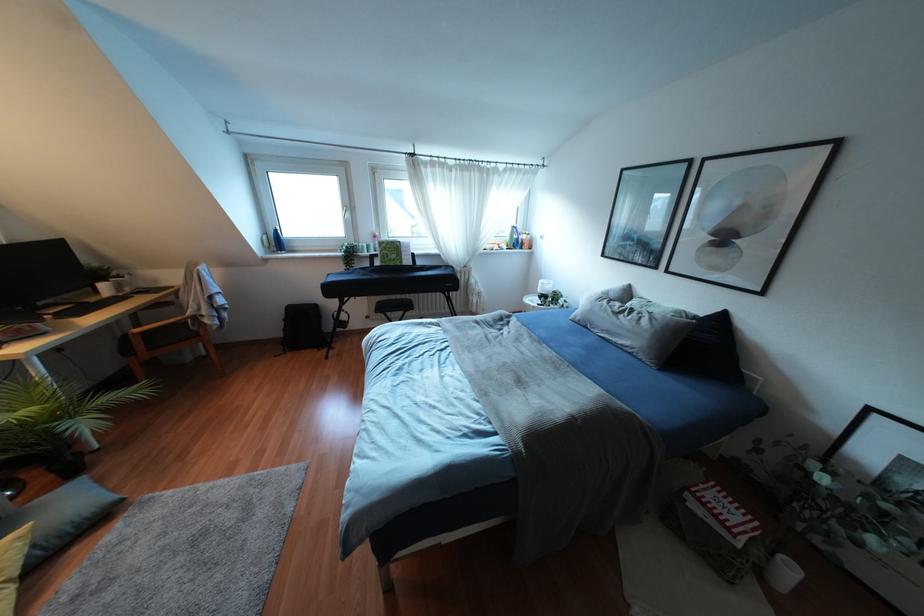
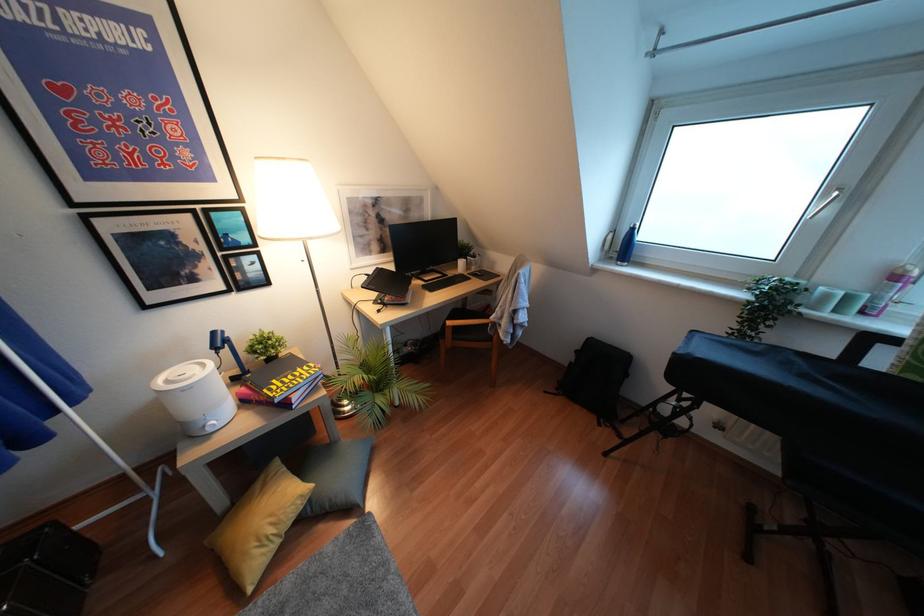
In the second image, find the point that corresponds to (x=373, y=236) in the first image.

(895, 277)